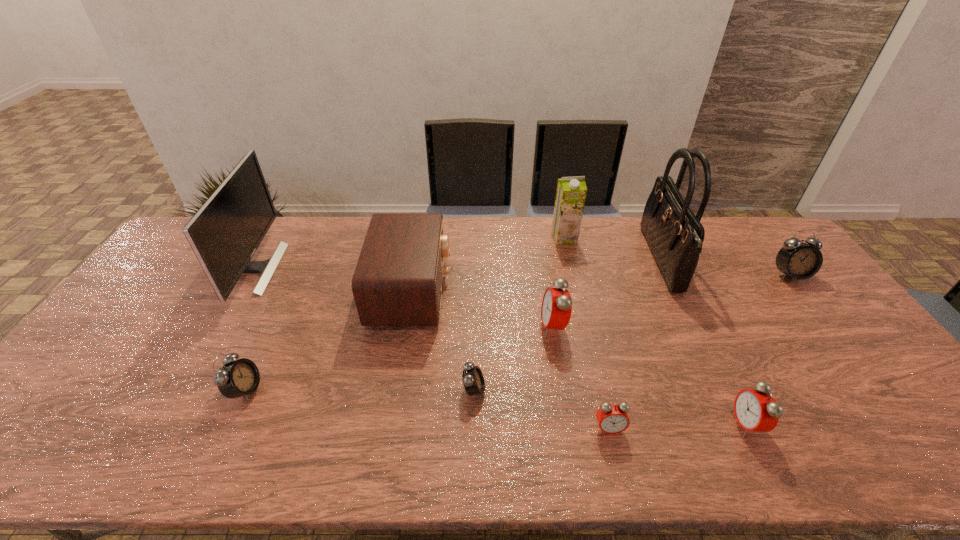
This screenshot has width=960, height=540. Find the location of `black handbag`. black handbag is located at coordinates (675, 235).

Where is `handbag`? handbag is located at coordinates (675, 235).

At what (x,y) coordinates should I click in order to perform the action: click on the leftmost object. Please return your answer as a coordinate pair (x, y). The width and height of the screenshot is (960, 540). Looking at the image, I should click on (224, 234).

Identify the location of monitor. The image size is (960, 540). (224, 234).

Identify the location of the third tallest object. (571, 192).

Identify the location of green soya milk. (571, 192).

At what (x,y) coordinates should I click in order to perform the action: click on radio receiver. Please return your answer as a coordinate pair (x, y). This screenshot has height=540, width=960. Looking at the image, I should click on (398, 278).

Locate an element on the screen. This screenshot has height=540, width=960. the seventh shortest object is located at coordinates pos(398,278).

The width and height of the screenshot is (960, 540). I want to click on the leftmost red alarm clock, so click(556, 308).

What are the coordinates of `the fifth object from left to right` in the screenshot? It's located at (556, 308).